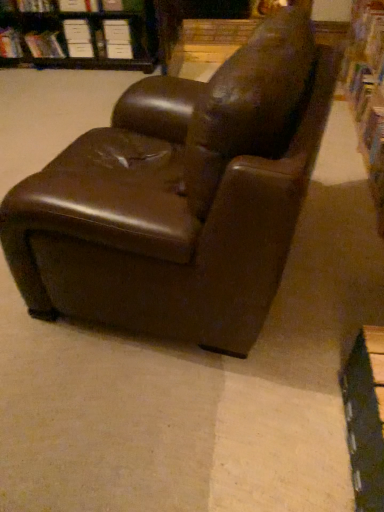
Question: Is point (21, 5) positioned closer to the camera than point (369, 135)?

Choices:
 (A) farther
 (B) closer

Answer: (A)

Question: Is hardcover book at upper left, the 1th book when ordered from top to bottom, to the left or to the right of hardcover book at upper right, the first book in the front-to-back sequence, in the image?

Choices:
 (A) left
 (B) right

Answer: (A)

Question: Which is farther from the white paper at upper left, which is the 1th paperback book from left to right?

Choices:
 (A) white paper at upper left, positioned as the 3th paperback book in right-to-left order
 (B) brown leather chair at center
 (C) hardcover book at upper left, positioned as the 2th book in back-to-front order
 (D) hardcover book at upper right, which ranks as the 4th book in left-to-right order
 (E) white paper at upper center, placed as the 2th paperback book when sorted from right to left

Answer: (B)

Question: Considering the real-world distances, which object is closest to the white paper book at upper left, arranged as the 4th book when viewed from the front?

Choices:
 (A) white paper at upper center, marked as the third paperback book in a left-to-right arrangement
 (B) white paper at upper center, which is the first paperback book from right to left
 (C) hardcover book at upper right, which ranks as the 4th book in left-to-right order
 (D) hardcover book at upper left, which appears as the 2th book when viewed from the left
 (E) brown leather chair at center

Answer: (D)